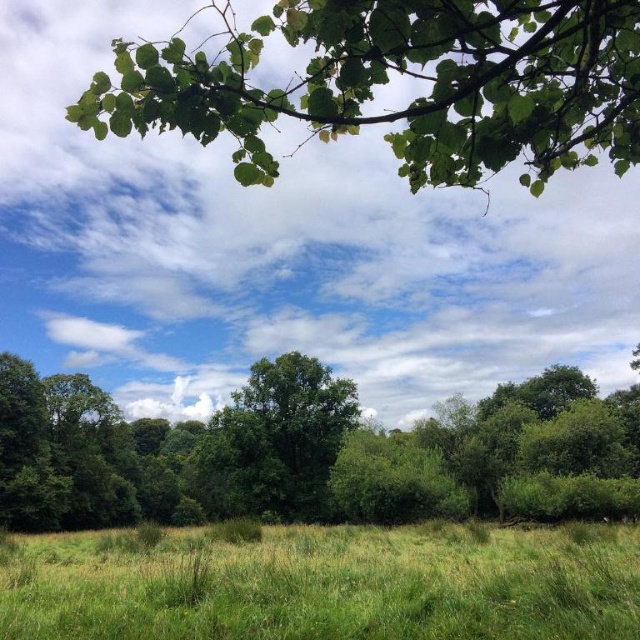
Image resolution: width=640 pixels, height=640 pixels. What do you see at coordinates (401, 74) in the screenshot?
I see `green leafy branch at upper center` at bounding box center [401, 74].

Which is in front, point (397, 116) or point (269, 464)?

Point (397, 116)

This screenshot has width=640, height=640. What are the coordinates of `green leafy branch at upper center` in the screenshot? It's located at (401, 74).

Is green leafy forest at center further to camera compared to green grass at lower center?

Yes, it is.

What do you see at coordinates (314, 452) in the screenshot? The image size is (640, 640). I see `green leafy forest at center` at bounding box center [314, 452].

I want to click on green leafy forest at center, so tap(314, 452).

Identify the location of green leafy forest at center. (314, 452).

Can you confirm if green leafy forest at center is positioned below green leafy branch at upper center?

Yes, green leafy forest at center is below green leafy branch at upper center.

Describe the element at coordinates (314, 452) in the screenshot. I see `green leafy forest at center` at that location.

Find the location of `green leafy forest at center`. green leafy forest at center is located at coordinates (314, 452).